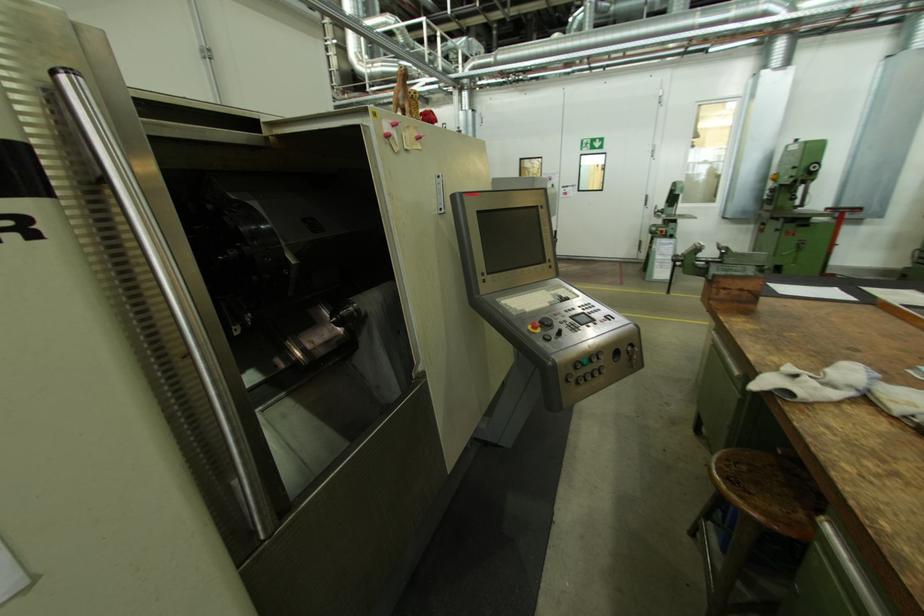
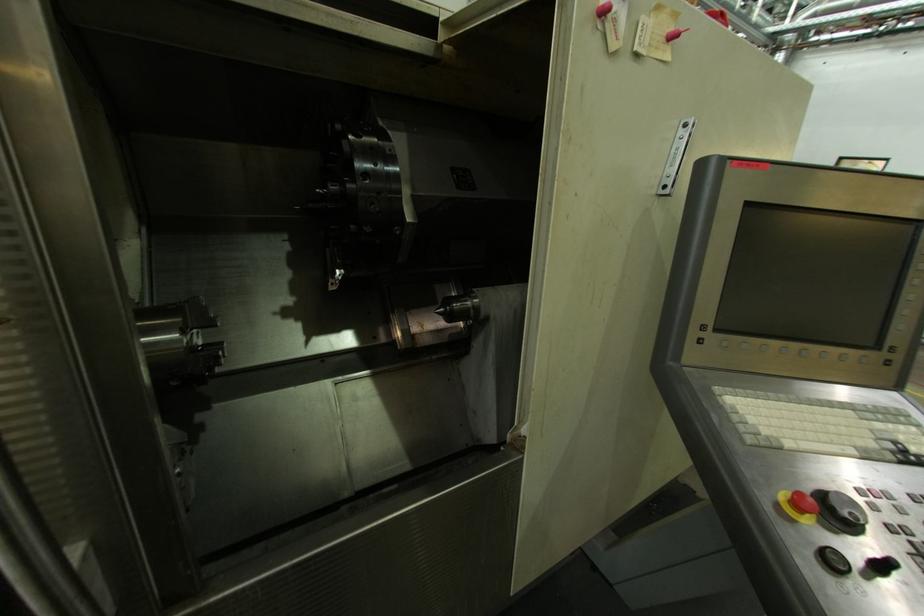
The point at (554, 339) is marked in the first image. Where is the corresponding point in the second image?

(847, 570)